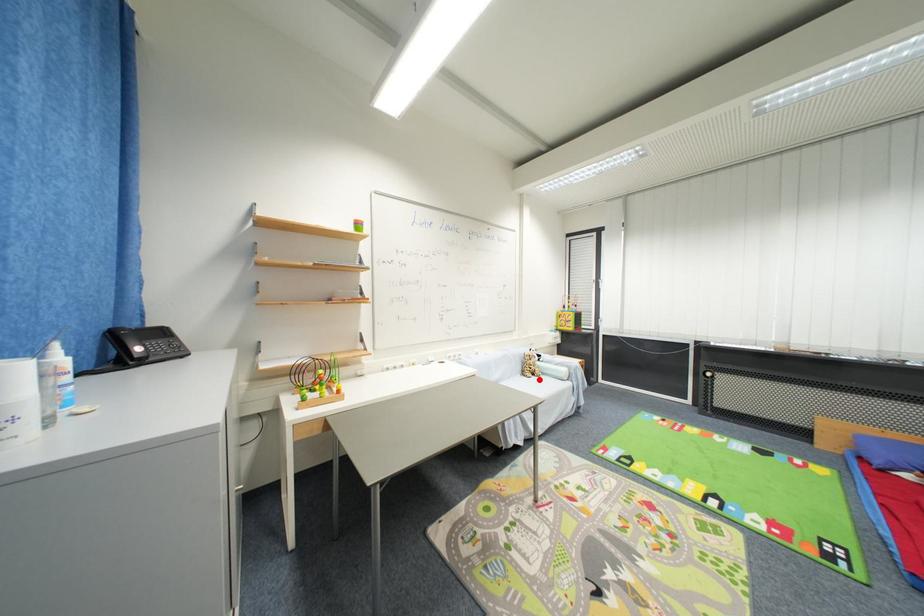
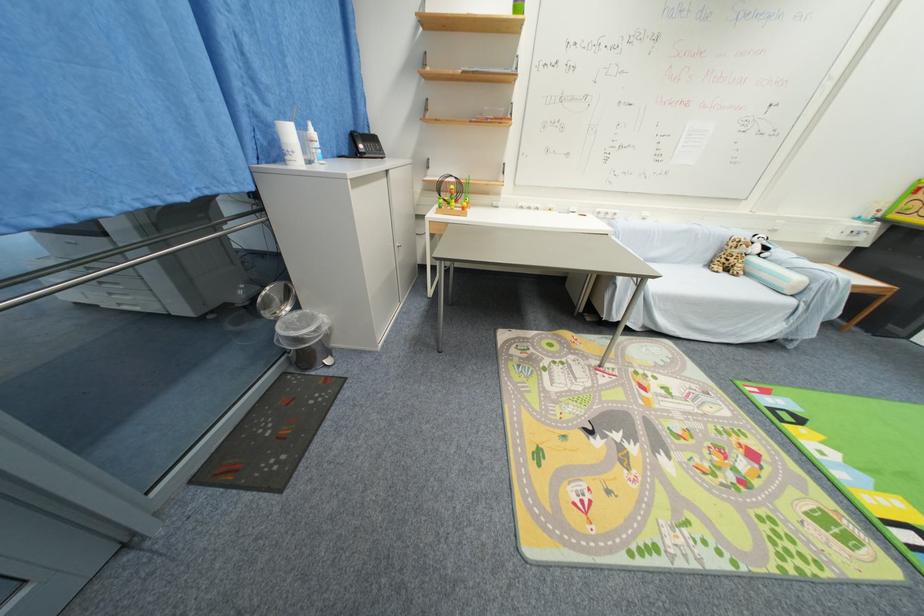
Find the pixel in the second image that matches the highlighted location in the first image.

(730, 276)